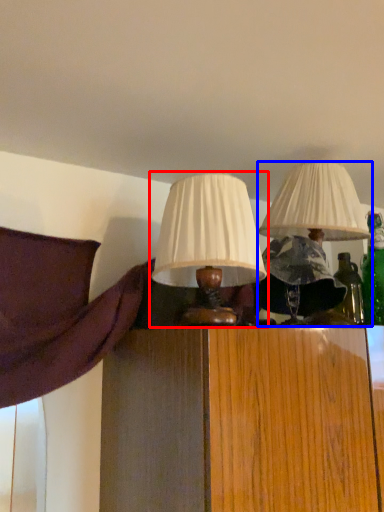
Question: Which object appears farthest to the camera in this image, lamp (highlighted by a red box) or lamp (highlighted by a blue box)?

Choices:
 (A) lamp
 (B) lamp

Answer: (B)